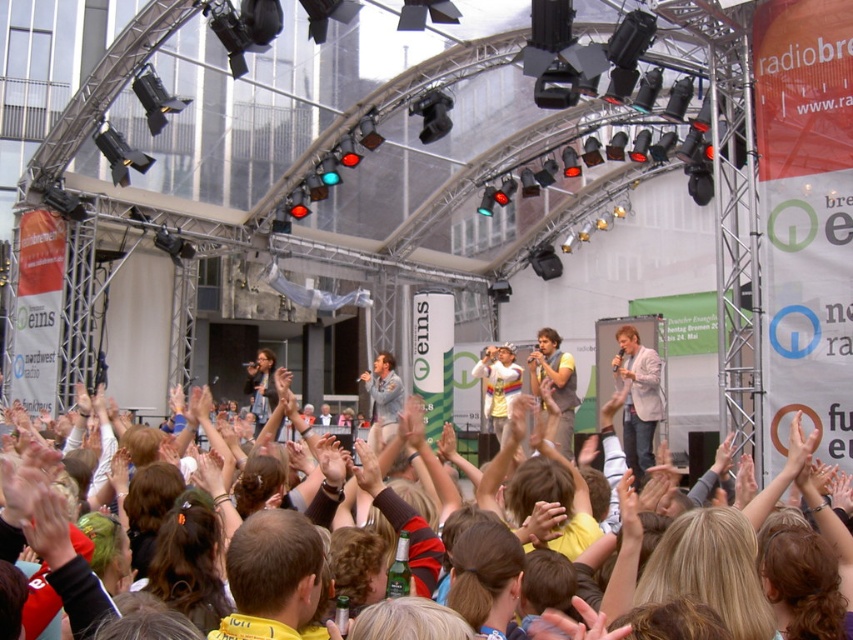
Between point (633, 406) and point (567, 429), which one is positioned in front?

Point (633, 406) is in front.

Who is positioned more to the right, light brown blazer at center or yellow fabric vest at center?

light brown blazer at center

The width and height of the screenshot is (853, 640). What do you see at coordinates (637, 397) in the screenshot?
I see `light brown blazer at center` at bounding box center [637, 397].

Where is `light brown blazer at center`? light brown blazer at center is located at coordinates (637, 397).

Does multicolored fabric crowd at center have a larger size compared to yellow fabric vest at center?

Correct, multicolored fabric crowd at center is larger in size than yellow fabric vest at center.

Who is lower down, multicolored fabric crowd at center or yellow fabric vest at center?

multicolored fabric crowd at center

What do you see at coordinates (399, 518) in the screenshot? This screenshot has width=853, height=640. I see `multicolored fabric crowd at center` at bounding box center [399, 518].

At what (x,y) coordinates should I click in order to perform the action: click on multicolored fabric crowd at center. Please return your answer as a coordinate pair (x, y). Looking at the image, I should click on (399, 518).

Between multicolored fabric crowd at center and light brown blazer at center, which one appears on the right side from the viewer's perspective?

light brown blazer at center is more to the right.

From the picture: Who is higher up, multicolored fabric crowd at center or light brown blazer at center?

Positioned higher is light brown blazer at center.

Based on the photo, who is more distant from viewer, (637, 529) or (660, 408)?

The point (660, 408) is more distant.

Identify the location of multicolored fabric crowd at center. The height and width of the screenshot is (640, 853). (399, 518).